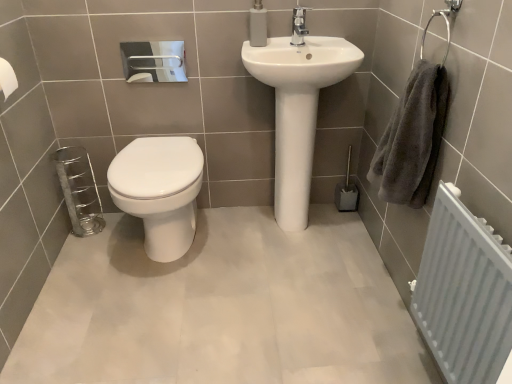
Where is `vacant space to the right of polished chrome faucet at upper center`? vacant space to the right of polished chrome faucet at upper center is located at coordinates (322, 39).